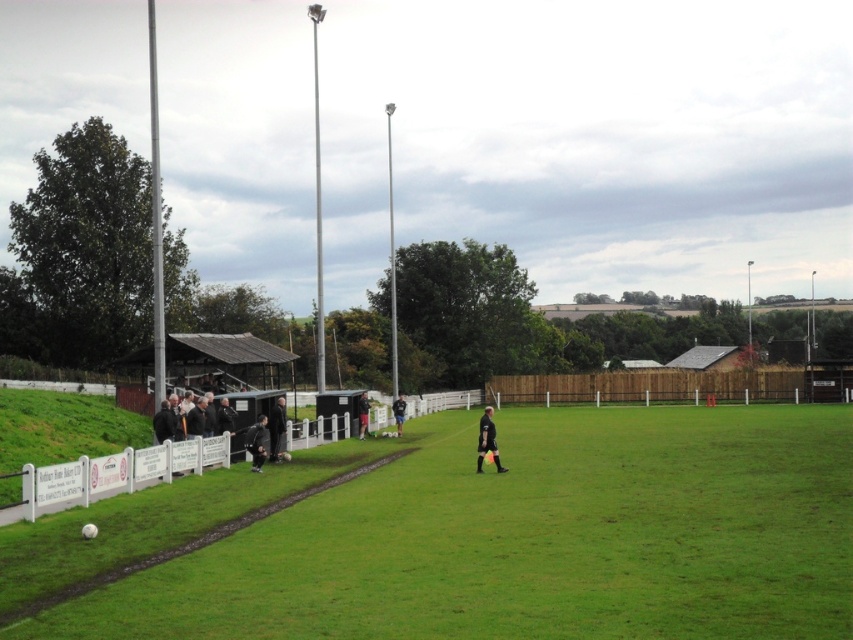
You are a photographer positioned at the back of the field. You need to capture a photo of both the dark gray uniform at center and the black matte jacket at center. Which object will appear taller in the photo?

The dark gray uniform at center will appear taller in the photo because it has a greater height compared to the black matte jacket at center.

You are a photographer trying to capture a wide shot of the soccer field. You notice the dark gray jacket at lower left and the dark gray uniform at center. Which of these two objects should you avoid placing near the edges of your photo to prevent them from being cut off?

The dark gray jacket at lower left is wider than the dark gray uniform at center, so you should avoid placing the dark gray jacket at lower left near the edges of your photo to prevent it from being cut off.